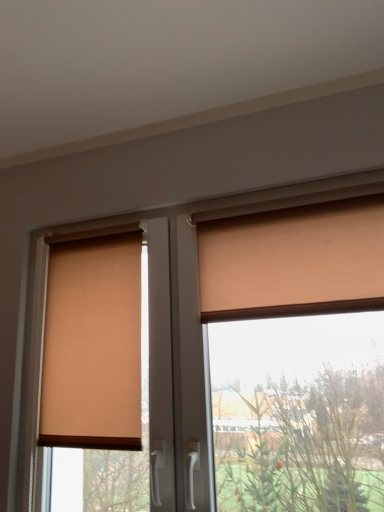
Question: Is matte beige blind at left at the back of matte orange roller blind at center?

Choices:
 (A) yes
 (B) no

Answer: (A)

Question: Does matte orange roller blind at center touch matte beige blind at left?

Choices:
 (A) no
 (B) yes

Answer: (A)

Question: Can you confirm if matte orange roller blind at center is thinner than matte beige blind at left?

Choices:
 (A) no
 (B) yes

Answer: (A)

Question: Considering the relative positions of matte orange roller blind at center and matte beige blind at left in the image provided, is matte orange roller blind at center to the left of matte beige blind at left from the viewer's perspective?

Choices:
 (A) no
 (B) yes

Answer: (A)

Question: Is matte orange roller blind at center closer to the viewer compared to matte beige blind at left?

Choices:
 (A) yes
 (B) no

Answer: (A)

Question: Is matte orange roller blind at center inside or outside of matte orange curtain at upper right?

Choices:
 (A) outside
 (B) inside

Answer: (A)

Question: From a real-world perspective, relative to matte orange curtain at upper right, is matte orange roller blind at center vertically above or below?

Choices:
 (A) below
 (B) above

Answer: (A)

Question: From the image's perspective, relative to matte orange curtain at upper right, is matte orange roller blind at center above or below?

Choices:
 (A) above
 (B) below

Answer: (B)

Question: In the image, is matte orange roller blind at center positioned in front of or behind matte orange curtain at upper right?

Choices:
 (A) front
 (B) behind

Answer: (A)

Question: Visually, is matte orange roller blind at center positioned to the left or to the right of matte beige blind at left?

Choices:
 (A) right
 (B) left

Answer: (A)

Question: Which is correct: matte orange roller blind at center is inside matte beige blind at left, or outside of it?

Choices:
 (A) outside
 (B) inside

Answer: (A)

Question: Considering the positions of matte orange roller blind at center and matte beige blind at left in the image, is matte orange roller blind at center bigger or smaller than matte beige blind at left?

Choices:
 (A) big
 (B) small

Answer: (A)

Question: Is matte orange roller blind at center taller or shorter than matte beige blind at left?

Choices:
 (A) tall
 (B) short

Answer: (A)

Question: From the image's perspective, is matte orange curtain at upper right located above or below matte beige blind at left?

Choices:
 (A) above
 (B) below

Answer: (A)

Question: From their relative heights in the image, would you say matte orange curtain at upper right is taller or shorter than matte beige blind at left?

Choices:
 (A) short
 (B) tall

Answer: (A)